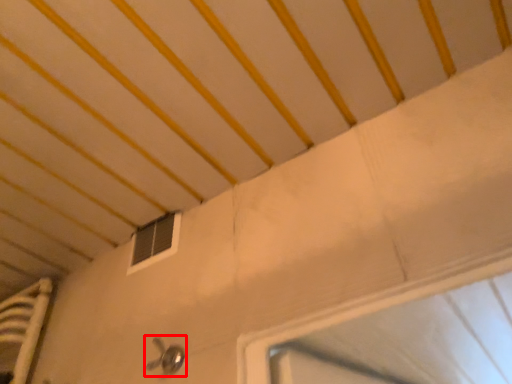
Question: From the image's perspective, what is the correct spatial positioning of door handle (annotated by the red box) in reference to window?

Choices:
 (A) above
 (B) below

Answer: (B)